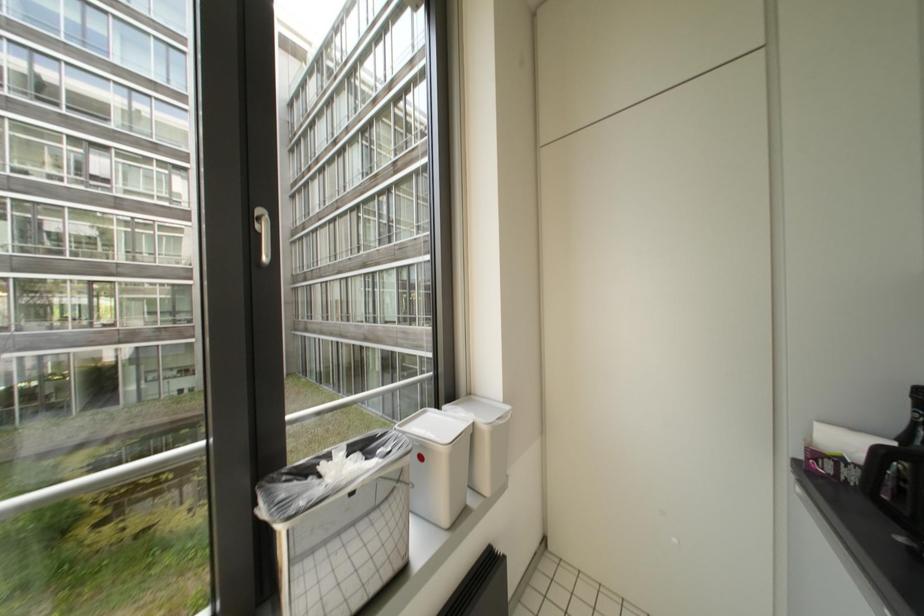
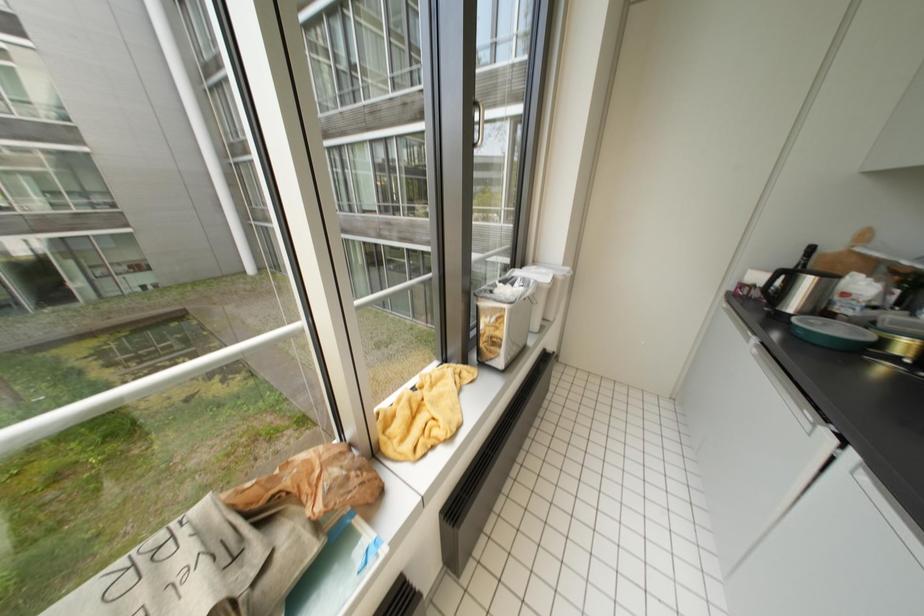
Which direction would the cameraman need to move to produce the second image?

The movement direction of the cameraman is left, backward.